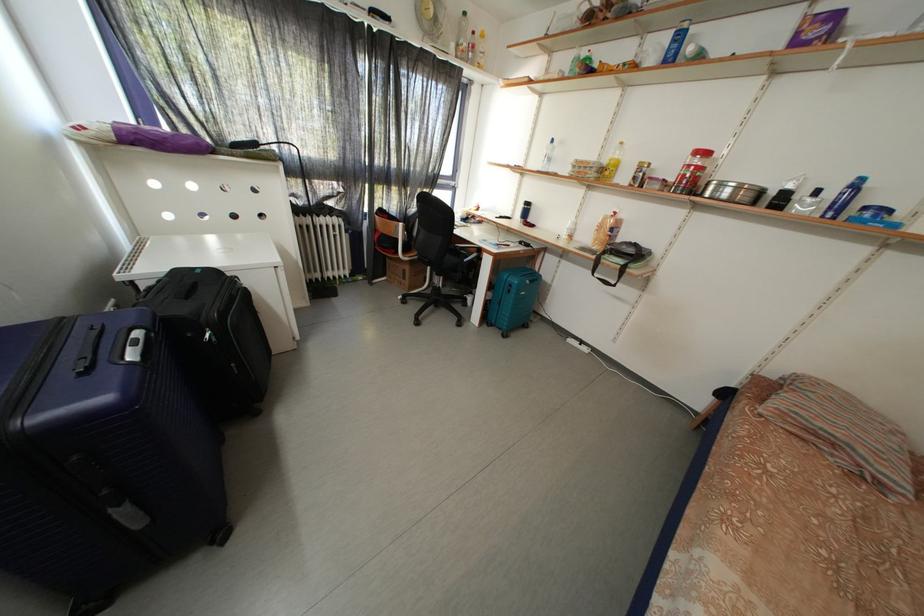
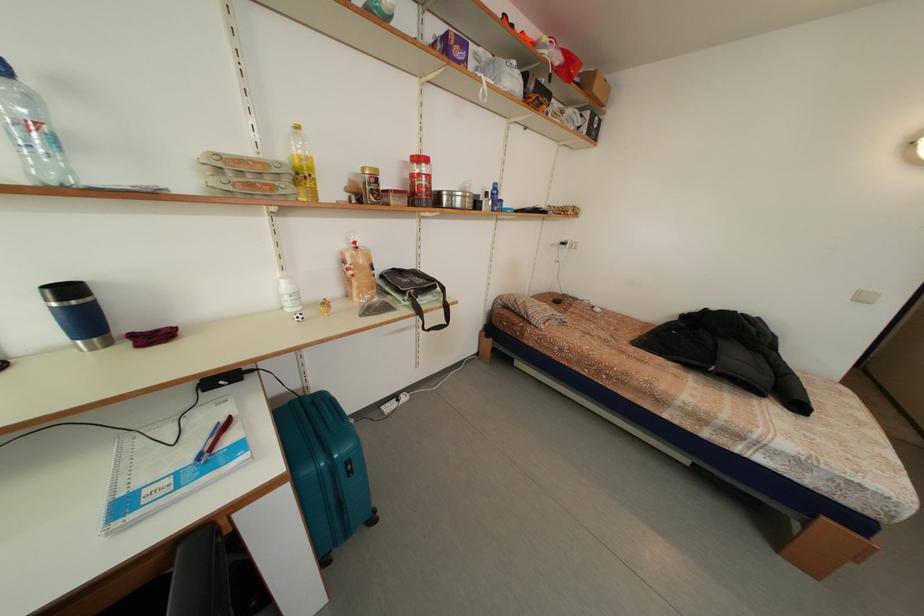
The point at (536, 209) is marked in the first image. Where is the corresponding point in the second image?

(78, 296)